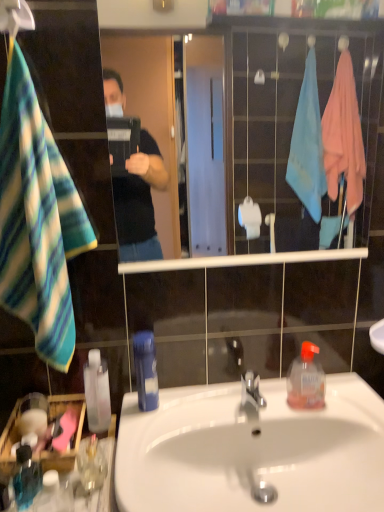
The height and width of the screenshot is (512, 384). I want to click on blue plastic bottle at sink, arranged as the fourth bottle when viewed from the left, so click(x=146, y=370).

Image resolution: width=384 pixels, height=512 pixels. What do you see at coordinates (90, 474) in the screenshot?
I see `translucent glass mug at lower left` at bounding box center [90, 474].

The image size is (384, 512). What do you see at coordinates (15, 17) in the screenshot?
I see `metallic silver hanger at upper left` at bounding box center [15, 17].

Based on the photo, in order to face striped fleece towel at left, should I rotate leftwards or rightwards?

Rotate your view left by about 20.565°.

Locate an element on the screen. The width and height of the screenshot is (384, 512). blue plastic bottle at sink, the 2th bottle when ordered from right to left is located at coordinates (146, 370).

Considering the sizes of translucent blue liquid at lower left, the first bottle from the left, and blue plastic bottle at sink, arranged as the fourth bottle when viewed from the left, in the image, is translucent blue liquid at lower left, the first bottle from the left, wider or thinner than blue plastic bottle at sink, arranged as the fourth bottle when viewed from the left,?

Clearly, translucent blue liquid at lower left, the first bottle from the left, has less width compared to blue plastic bottle at sink, arranged as the fourth bottle when viewed from the left.

Where is `the 3rd bottle to the right when counting from the translucent blue liquid at lower left, the 5th bottle in the right-to-left sequence`? The image size is (384, 512). the 3rd bottle to the right when counting from the translucent blue liquid at lower left, the 5th bottle in the right-to-left sequence is located at coordinates (146, 370).

Is translucent blue liquid at lower left, the 5th bottle in the right-to-left sequence, oriented towards blue plastic bottle at sink, the 2th bottle when ordered from right to left?

No, translucent blue liquid at lower left, the 5th bottle in the right-to-left sequence, is not oriented towards blue plastic bottle at sink, the 2th bottle when ordered from right to left.

Can you tell me how much translucent blue liquid at lower left, the first bottle from the left, and blue plastic bottle at sink, arranged as the fourth bottle when viewed from the left, differ in facing direction?

translucent blue liquid at lower left, the first bottle from the left, and blue plastic bottle at sink, arranged as the fourth bottle when viewed from the left, are facing 2.81 degrees away from each other.

Image resolution: width=384 pixels, height=512 pixels. What are the coordinates of `the 3rd bottle to the right of the metallic silver hanger at upper left, starting your count from the anchor` in the screenshot? It's located at (97, 392).

Is transparent plastic bottle at lower left, the third bottle viewed from the right, bigger than metallic silver hanger at upper left?

Yes.

From the image's perspective, is transparent plastic bottle at lower left, the third bottle viewed from the right, above or below metallic silver hanger at upper left?

transparent plastic bottle at lower left, the third bottle viewed from the right, is situated lower than metallic silver hanger at upper left in the image.

Is transparent plastic bottle at lower left, the third bottle viewed from the right, oriented towards metallic silver hanger at upper left?

No, transparent plastic bottle at lower left, the third bottle viewed from the right, is not oriented towards metallic silver hanger at upper left.

Is white glossy sink at center located outside translucent glass mug at lower left?

Yes, white glossy sink at center is not within translucent glass mug at lower left.

Is white glossy sink at center smaller than translucent glass mug at lower left?

No.

How different are the orientations of white glossy sink at center and translucent glass mug at lower left in degrees?

The angle between the facing direction of white glossy sink at center and the facing direction of translucent glass mug at lower left is 1.14 degrees.

Who is taller, white glossy sink at center or translucent glass mug at lower left?

white glossy sink at center.

Based on their positions, is translucent plastic hand sanitizer at lower right, marked as the first bottle in a right-to-left arrangement, located to the left or right of blue plastic bottle at sink, the 2th bottle when ordered from right to left?

In the image, translucent plastic hand sanitizer at lower right, marked as the first bottle in a right-to-left arrangement, appears on the right side of blue plastic bottle at sink, the 2th bottle when ordered from right to left.

What are the coordinates of `bottle above the translucent plastic hand sanitizer at lower right, marked as the first bottle in a right-to-left arrangement (from a real-world perspective)` in the screenshot? It's located at [146, 370].

From a real-world perspective, is translucent plastic hand sanitizer at lower right, the 5th bottle from the left, positioned over blue plastic bottle at sink, the 2th bottle when ordered from right to left, based on gravity?

Actually, translucent plastic hand sanitizer at lower right, the 5th bottle from the left, is physically below blue plastic bottle at sink, the 2th bottle when ordered from right to left, in the real world.

From the picture: From the image's perspective, which object appears higher, clear glass mirror at center or striped fleece towel at left?

clear glass mirror at center is shown above in the image.

You are a GUI agent. You are given a task and a screenshot of the screen. Output one action in this format:
    pyautogui.click(x=<x>, y=<y>)
    Task: Click on the towel/napkin below the clear glass mirror at center (from the image's perspective)
    The height and width of the screenshot is (512, 384).
    Given the screenshot: What is the action you would take?
    tap(37, 220)

From a real-world perspective, which is physically below, clear glass mirror at center or striped fleece towel at left?

striped fleece towel at left is physically lower.

Does clear glass mirror at center appear on the right side of striped fleece towel at left?

Correct, you'll find clear glass mirror at center to the right of striped fleece towel at left.

Is point (111, 16) behind point (83, 497)?

Yes, point (111, 16) is behind point (83, 497).

Is clear glass mirror at center inside or outside of translucent glass mug at lower left?

clear glass mirror at center is not inside translucent glass mug at lower left, it's outside.

What's the angular difference between clear glass mirror at center and translucent glass mug at lower left's facing directions?

1.07 degrees separate the facing orientations of clear glass mirror at center and translucent glass mug at lower left.

Is white glossy sink at center smaller than metallic silver hanger at upper left?

Incorrect, white glossy sink at center is not smaller in size than metallic silver hanger at upper left.

Based on the photo, based on their positions, is white glossy sink at center located to the left or right of metallic silver hanger at upper left?

Based on their positions, white glossy sink at center is located to the right of metallic silver hanger at upper left.

Identify the location of hanger lying on the left of white glossy sink at center. (15, 17).

Is white glossy sink at center oriented away from metallic silver hanger at upper left?

No, metallic silver hanger at upper left is not at the back of white glossy sink at center.

Where is `the 1st bottle in front of the blue plastic bottle at sink, the 2th bottle when ordered from right to left`? The height and width of the screenshot is (512, 384). the 1st bottle in front of the blue plastic bottle at sink, the 2th bottle when ordered from right to left is located at coordinates (26, 478).

The height and width of the screenshot is (512, 384). I want to click on the 3rd bottle to the right of the metallic silver hanger at upper left, counting from the anchor's position, so click(97, 392).

Looking at the image, which one is located further to clear glass mirror at center, transparent plastic bottle at lower left, the third bottle viewed from the right, or translucent glass mug at lower left?

translucent glass mug at lower left lies further to clear glass mirror at center than the other object.

When comparing their distances from clear glass mirror at center, does translucent plastic bottle at lower left, which ranks as the 4th bottle in right-to-left order, or striped fleece towel at left seem closer?

striped fleece towel at left is closer to clear glass mirror at center.

Looking at the image, which one is located closer to clear glass mirror at center, translucent plastic bottle at lower left, which is the 2th bottle in left-to-right order, or translucent plastic hand sanitizer at lower right, the 5th bottle from the left?

translucent plastic hand sanitizer at lower right, the 5th bottle from the left, is closer to clear glass mirror at center.

Looking at the image, which one is located closer to striped fleece towel at left, metallic silver hanger at upper left or transparent plastic bottle at lower left, which is the 3th bottle from left to right?

transparent plastic bottle at lower left, which is the 3th bottle from left to right, lies closer to striped fleece towel at left than the other object.

In the scene shown: When comparing their distances from striped fleece towel at left, does translucent glass mug at lower left or metallic silver hanger at upper left seem closer?

metallic silver hanger at upper left is closer to striped fleece towel at left.

Which object lies further to the anchor point metallic silver hanger at upper left, clear glass mirror at center or translucent glass mug at lower left?

The object further to metallic silver hanger at upper left is clear glass mirror at center.

Looking at the image, which one is located closer to clear glass mirror at center, translucent plastic bottle at lower left, which ranks as the 4th bottle in right-to-left order, or blue plastic bottle at sink, the 2th bottle when ordered from right to left?

Based on the image, blue plastic bottle at sink, the 2th bottle when ordered from right to left, appears to be nearer to clear glass mirror at center.

When comparing their distances from translucent plastic hand sanitizer at lower right, marked as the first bottle in a right-to-left arrangement, does blue plastic bottle at sink, the 2th bottle when ordered from right to left, or metallic silver hanger at upper left seem further?

metallic silver hanger at upper left.

Locate an element on the screen. This screenshot has width=384, height=512. sink between striped fleece towel at left and translucent plastic hand sanitizer at lower right, marked as the first bottle in a right-to-left arrangement is located at coordinates (252, 450).

Locate an element on the screen. This screenshot has width=384, height=512. coffee cup between translucent plastic bottle at lower left, which is the 2th bottle in left-to-right order, and transparent plastic bottle at lower left, which is the 3th bottle from left to right, along the z-axis is located at coordinates (90, 474).

Locate an element on the screen. mirror between metallic silver hanger at upper left and translucent plastic bottle at lower left, which ranks as the 4th bottle in right-to-left order, from top to bottom is located at coordinates (151, 16).

At what (x,y) coordinates should I click in order to perform the action: click on coffee cup between striped fleece towel at left and white glossy sink at center vertically. Please return your answer as a coordinate pair (x, y). This screenshot has height=512, width=384. Looking at the image, I should click on (90, 474).